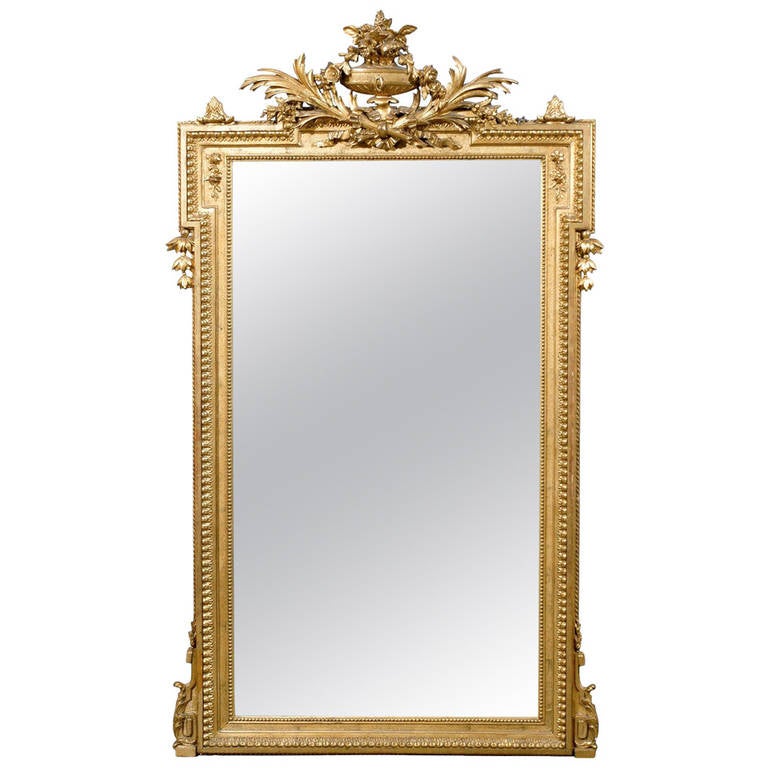
Identify the location of gold mirror frame. Image resolution: width=768 pixels, height=768 pixels. (213, 600).